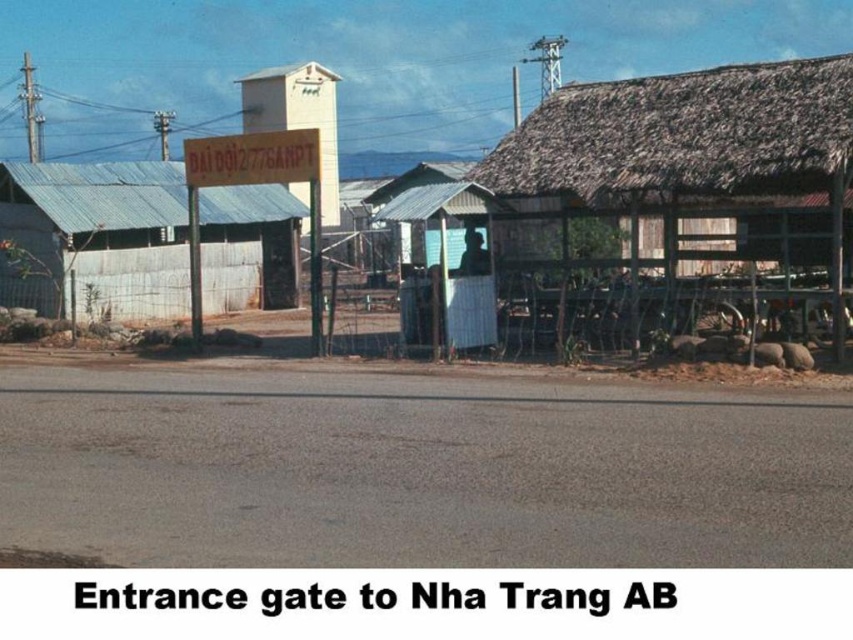
Looking at this image, you are planning to set up a temporary booth for visitors at the entrance of Nha Trang AB. You have two options for locations. One is next to the thatched roof hut at right, and the other is next to the metal corrugated roof hut at left. Considering the space each occupies, which location would allow for more space for your booth?

The metal corrugated roof hut at left occupies more space than the thatched roof hut at right, so placing the booth next to the metal corrugated roof hut at left would allow for more space.

You are planning to install a new security camera at the entrance of Nha Trang AB. The camera needs to be placed on the highest point between the metal corrugated roof at upper center and the metal corrugated roof hut at left. Which roof should you choose?

The metal corrugated roof at upper center is bigger than the metal corrugated roof hut at left, so you should place the camera on the metal corrugated roof at upper center as it is the higher point.

You are a visitor arriving at Nha Trang AB and need to find the guardhouse. Which of the two huts should you approach, the thatched roof hut at right or the metal corrugated roof hut at left?

The metal corrugated roof hut at left is the guardhouse because it is taller than the thatched roof hut at right, which is shorter.